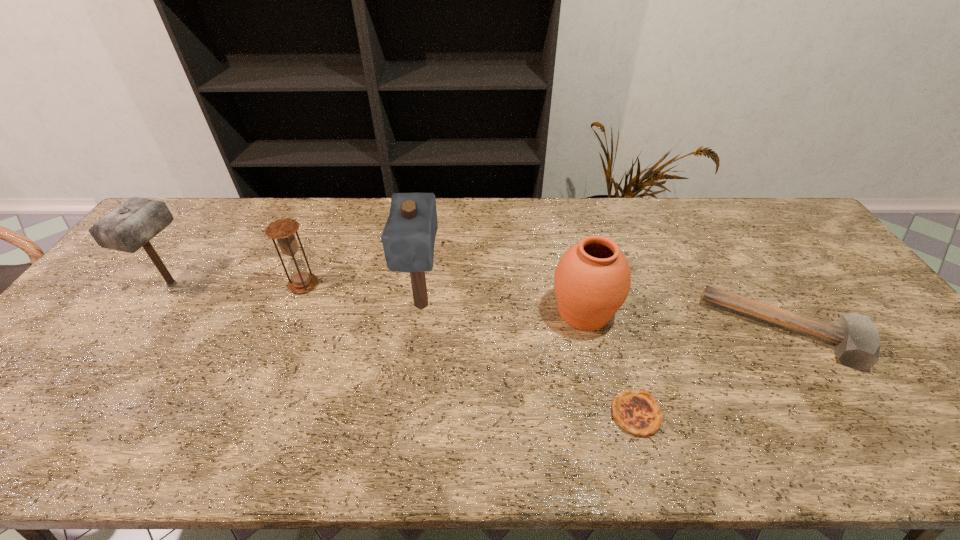
The image size is (960, 540). Find the location of `vacant space that's between the leftmost object and the fifth object from right to left`. vacant space that's between the leftmost object and the fifth object from right to left is located at coordinates (238, 284).

What are the coordinates of `object that can be found as the second closest to the nearest object` in the screenshot? It's located at (856, 340).

Identify the location of object that is the closest to the urn. This screenshot has width=960, height=540. (637, 412).

Image resolution: width=960 pixels, height=540 pixels. Find the location of `mallet that is the second nearest to the third object from left to right`. mallet that is the second nearest to the third object from left to right is located at coordinates (856, 340).

Locate an element on the screen. The width and height of the screenshot is (960, 540). mallet that stands as the closest to the leftmost mallet is located at coordinates (408, 238).

Where is `free location that satisfies the following two spatial constraints: 1. on the front side of the fifth tallest object; 2. on the right side of the hourglass`? free location that satisfies the following two spatial constraints: 1. on the front side of the fifth tallest object; 2. on the right side of the hourglass is located at coordinates (284, 331).

You are a GUI agent. You are given a task and a screenshot of the screen. Output one action in this format:
    pyautogui.click(x=<x>, y=<y>)
    Task: Click on the free spot that satisfies the following two spatial constraints: 1. on the front side of the hourglass; 2. on the right side of the second mallet from right to left
    This screenshot has height=540, width=960.
    Given the screenshot: What is the action you would take?
    pyautogui.click(x=295, y=305)